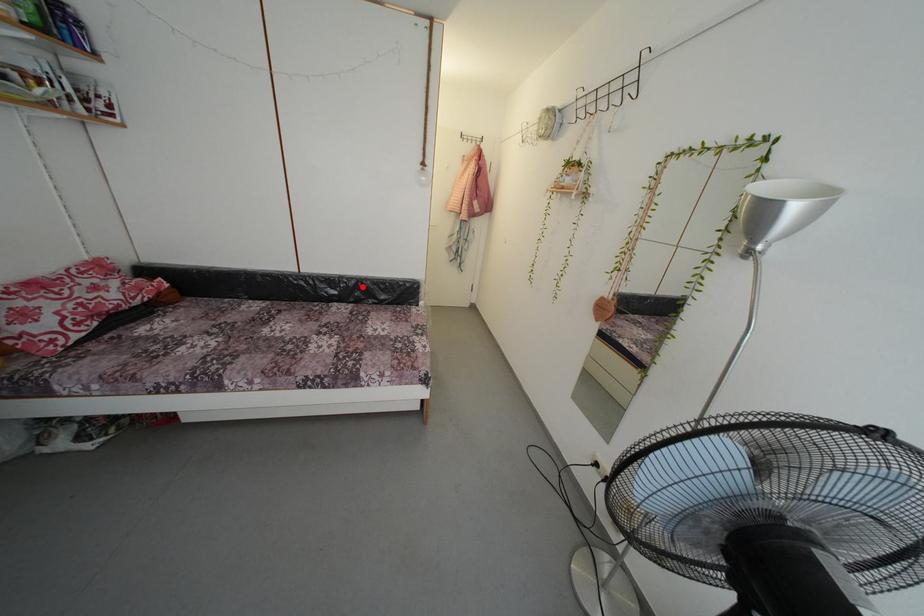
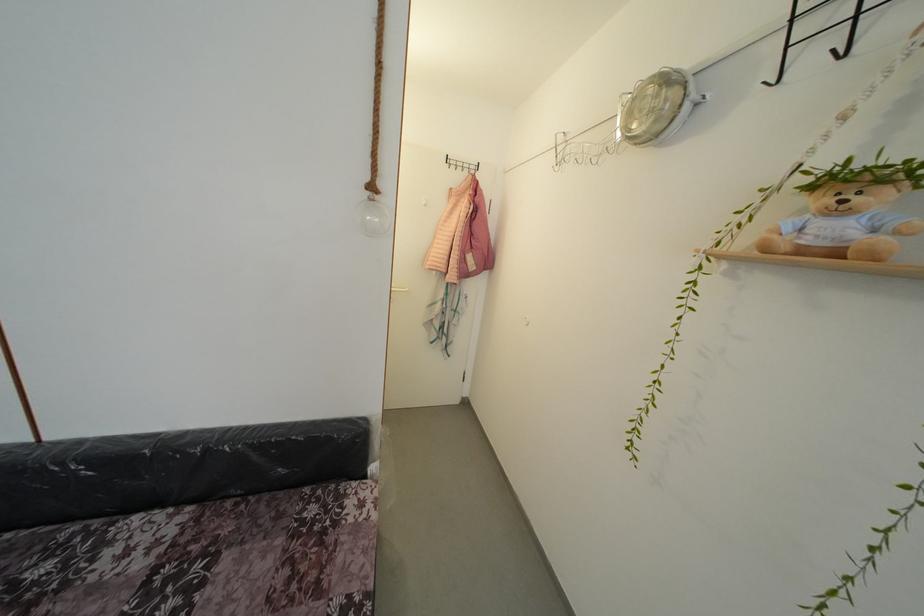
The point at the highlighted location is marked in the first image. Where is the corresponding point in the second image?

(213, 456)